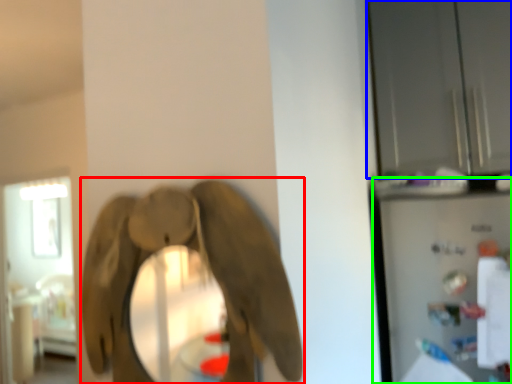
Question: Estimate the real-world distances between objects in this image. Which object is farther from elephant (highlighted by a red box), glass door (highlighted by a blue box) or appliance (highlighted by a green box)?

Choices:
 (A) glass door
 (B) appliance

Answer: (A)